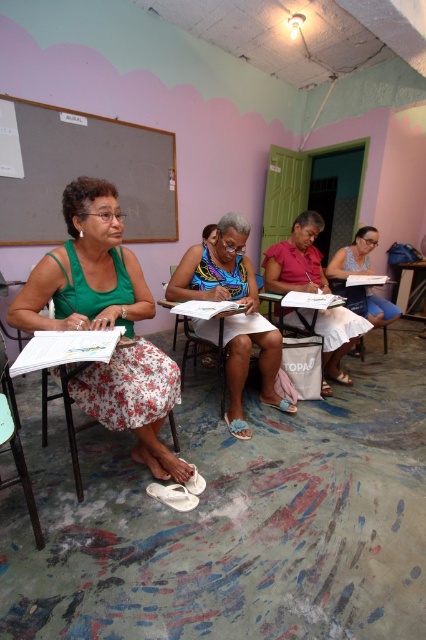
You are an observer sitting at the back of the classroom. You notice a matte pink shirt at center and a white paper at right. Which object is positioned more to the left?

The matte pink shirt at center is positioned to the left of the white paper at right, so the matte pink shirt at center is more to the left.

You are a photographer standing in the room and want to take a picture of the matte pink shirt at center and the wooden table at center. Which object will appear larger in the photo?

The matte pink shirt at center will appear larger in the photo because it is much taller than the wooden table at center.